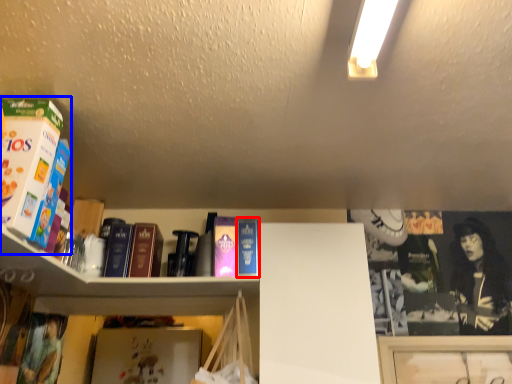
Question: Which object is further to the camera taking this photo, paperback book (highlighted by a red box) or book (highlighted by a blue box)?

Choices:
 (A) paperback book
 (B) book

Answer: (A)